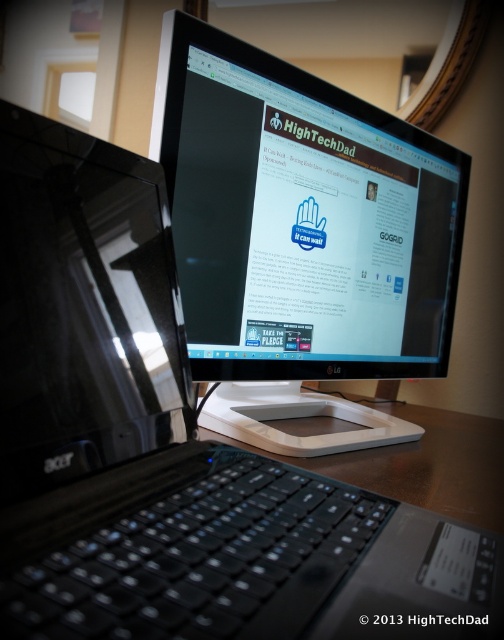
You are organizing a presentation and need to adjust the placement of your equipment. You have a glossy black monitor at center and a brown wooden table at center. Which object is positioned higher in the workspace setup?

The glossy black monitor at center is positioned above the brown wooden table at center, so it is higher in the workspace setup.

You are a delivery person who just arrived at the office. You need to place a 24 inch box on the desk without moving any existing items. The desk has the black glossy monitor at upper center. Is there enough space on the desk to place the box in front of the monitor?

The black glossy monitor at upper center and viewer are 23.03 inches apart. Since the box is 24 inches wide, it would not fit in front of the monitor as the available space is narrower than the box.